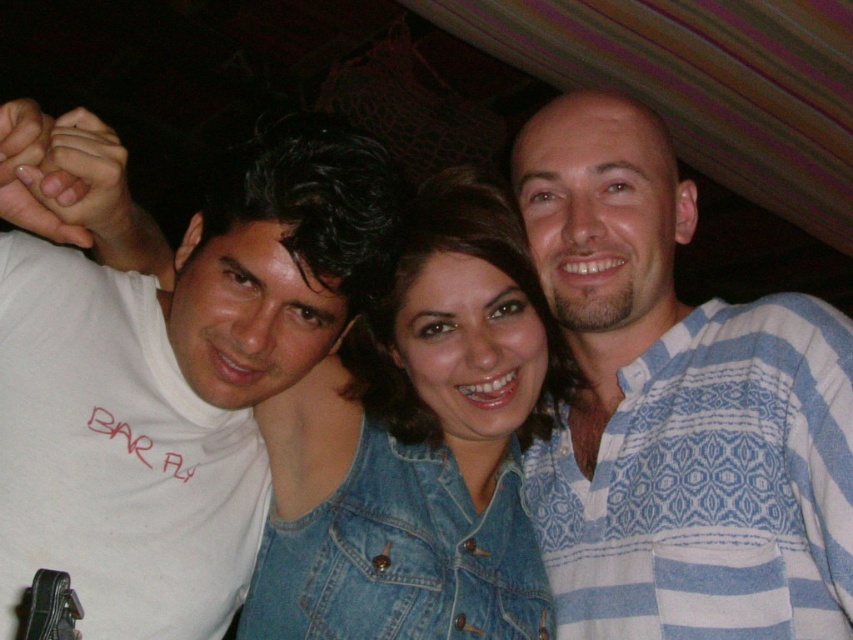
Question: Does blue striped shirt at right have a lesser width compared to denim jacket at center?

Choices:
 (A) yes
 (B) no

Answer: (A)

Question: Which object is the closest to the denim jacket at center?

Choices:
 (A) blue striped shirt at right
 (B) white matte t-shirt at left

Answer: (B)

Question: Is blue striped shirt at right further to camera compared to denim jacket at center?

Choices:
 (A) no
 (B) yes

Answer: (A)

Question: Which point is closer to the camera?

Choices:
 (A) (20, 248)
 (B) (634, 618)

Answer: (A)

Question: Among these points, which one is farthest from the camera?

Choices:
 (A) (316, 538)
 (B) (700, 339)

Answer: (B)

Question: Can you confirm if blue striped shirt at right is positioned to the left of white matte t-shirt at left?

Choices:
 (A) no
 (B) yes

Answer: (A)